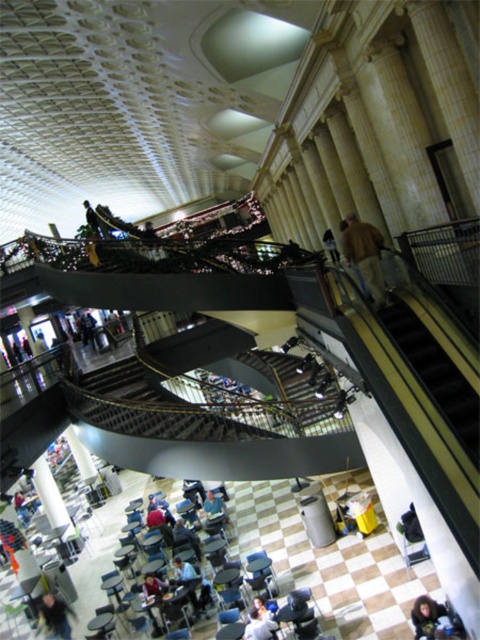
Can you confirm if white fabric bag at lower center is thinner than dark brown leather jacket at upper left?

Yes.

Which is behind, point (252, 620) or point (85, 209)?

Point (85, 209)

Locate an element on the screen. This screenshot has width=480, height=640. white fabric bag at lower center is located at coordinates (260, 627).

Is brown leather jacket at upper right further to camera compared to dark brown leather jacket at upper center?

No.

Does brown leather jacket at upper right have a larger size compared to dark brown leather jacket at upper center?

No, brown leather jacket at upper right is not bigger than dark brown leather jacket at upper center.

Does point (376, 296) lie behind point (154, 244)?

That is False.

The height and width of the screenshot is (640, 480). I want to click on brown leather jacket at upper right, so click(x=364, y=253).

Does metallic staircase at center appear on the right side of dark brown leather jacket at upper left?

Indeed, metallic staircase at center is positioned on the right side of dark brown leather jacket at upper left.

Who is more distant from viewer, (x=319, y=412) or (x=93, y=218)?

The point (x=93, y=218) is more distant.

At what (x,y) coordinates should I click in order to perform the action: click on metallic staircase at center. Please return your answer as a coordinate pair (x, y). Looking at the image, I should click on (288, 397).